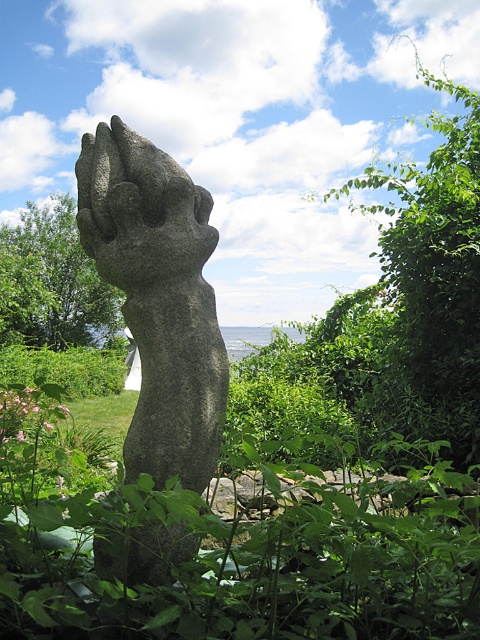
You are standing in front of the large stone sculpture and want to place two markers at the coordinates point (197,262) and point (93,340). Which marker will be closer to you?

Point (197,262) is closer to the viewer than point (93,340), so the marker at point (197,262) will be closer to you.

You are a landscape architect designing a garden path that needs to pass between the gray stone hand at center and the green leafy bush at center. The path must be at least 1 meter wide. Can you determine if there is enough space between them based on their widths?

The gray stone hand at center is narrower than the green leafy bush at center. However, the exact width difference isn

You are a gardener planning to water both the gray stone hand at center and the green leafy bush at center. Your watering can holds enough water for 50 feet of travel. Can you water both without needing to refill?

The gray stone hand at center and green leafy bush at center are 45.54 feet apart from each other. Since the distance between them is less than 50 feet, you can water both without needing to refill.